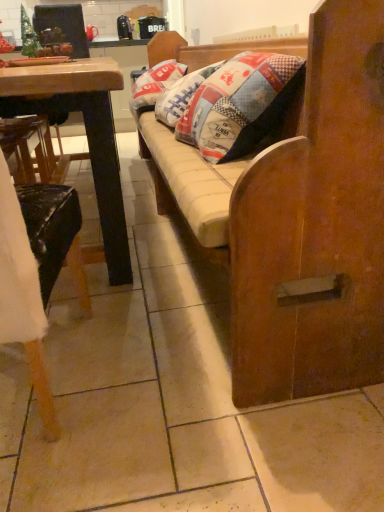
Image resolution: width=384 pixels, height=512 pixels. In order to click on free space to the right of wooden chair at left in this screenshot , I will do `click(153, 382)`.